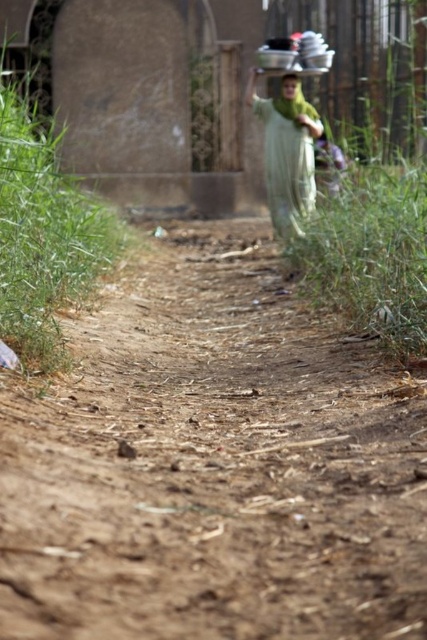
Question: Is brown dirt track at center wider than green fabric at center?

Choices:
 (A) no
 (B) yes

Answer: (A)

Question: Estimate the real-world distances between objects in this image. Which object is closer to the brown dirt track at center?

Choices:
 (A) green fabric head at upper center
 (B) green fabric at center

Answer: (B)

Question: Is brown dirt track at center closer to the viewer compared to green fabric at center?

Choices:
 (A) yes
 (B) no

Answer: (A)

Question: Estimate the real-world distances between objects in this image. Which object is farther from the green fabric head at upper center?

Choices:
 (A) brown dirt track at center
 (B) green fabric at center

Answer: (A)

Question: Does brown dirt track at center appear over green fabric at center?

Choices:
 (A) no
 (B) yes

Answer: (A)

Question: Which of the following is the closest to the observer?

Choices:
 (A) brown dirt track at center
 (B) green fabric head at upper center
 (C) green fabric at center

Answer: (A)